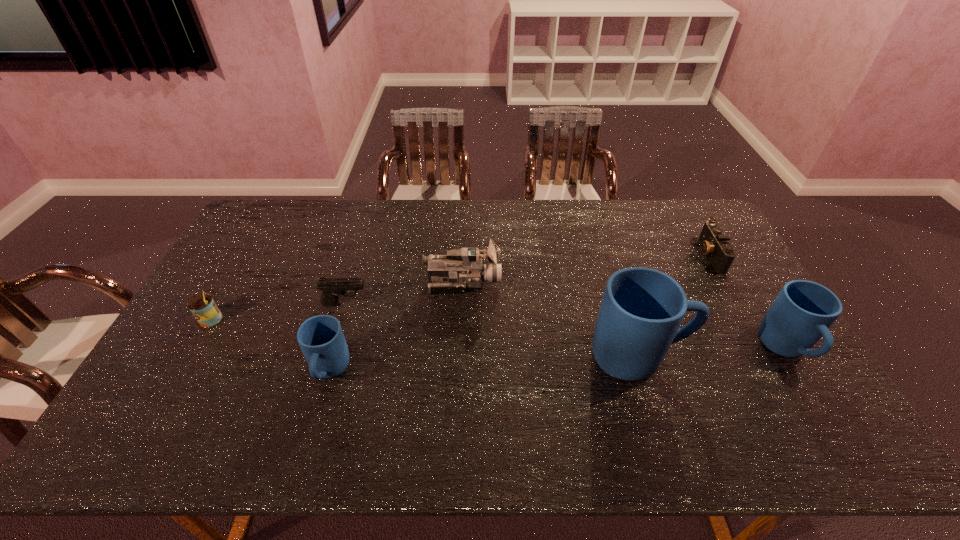
Locate an element on the screen. The image size is (960, 540). free space for an extra mug to achieve even spacing is located at coordinates coord(486,364).